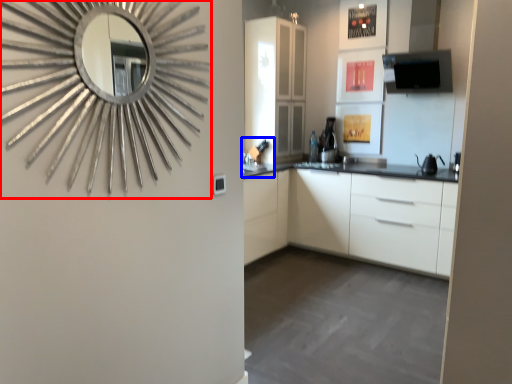
Question: Which object appears farthest to the camera in this image, mirror (highlighted by a red box) or sink (highlighted by a blue box)?

Choices:
 (A) mirror
 (B) sink

Answer: (B)